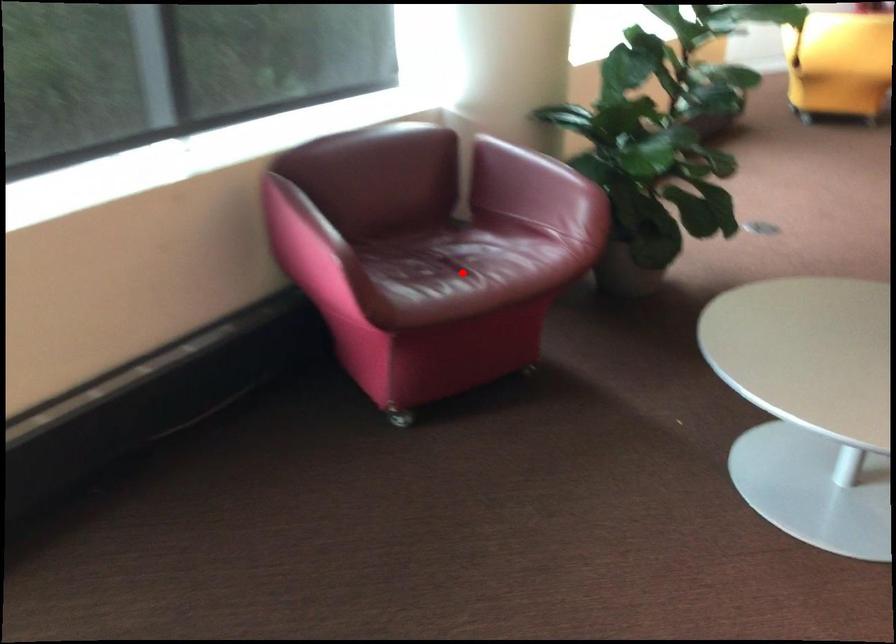
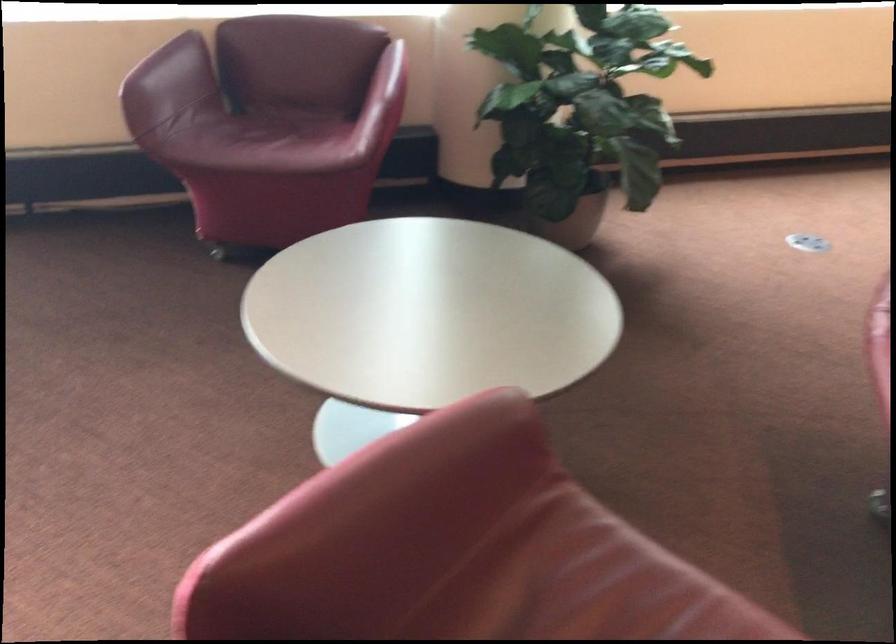
The point at the highlighted location is marked in the first image. Where is the corresponding point in the second image?

(263, 140)